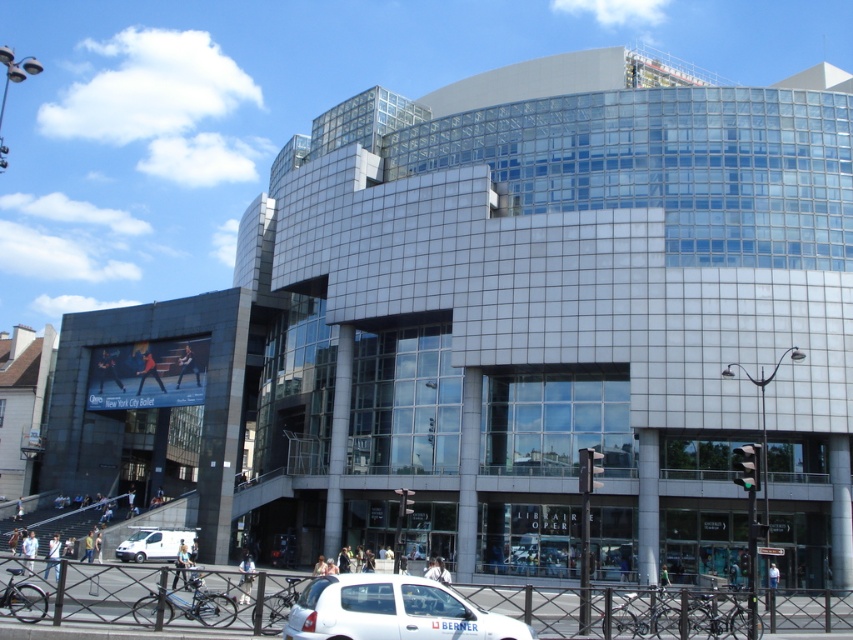
Question: Which point is farther to the camera?

Choices:
 (A) (169, 538)
 (B) (427, 600)

Answer: (A)

Question: Is the position of white matte car at lower center more distant than that of white matte van at lower left?

Choices:
 (A) yes
 (B) no

Answer: (B)

Question: Which point is closer to the camera?

Choices:
 (A) (173, 552)
 (B) (346, 618)

Answer: (B)

Question: Is white matte car at lower center positioned behind white matte van at lower left?

Choices:
 (A) no
 (B) yes

Answer: (A)

Question: Is white matte car at lower center in front of white matte van at lower left?

Choices:
 (A) yes
 (B) no

Answer: (A)

Question: Which point appears closest to the camera in this image?

Choices:
 (A) (126, 552)
 (B) (432, 632)

Answer: (B)